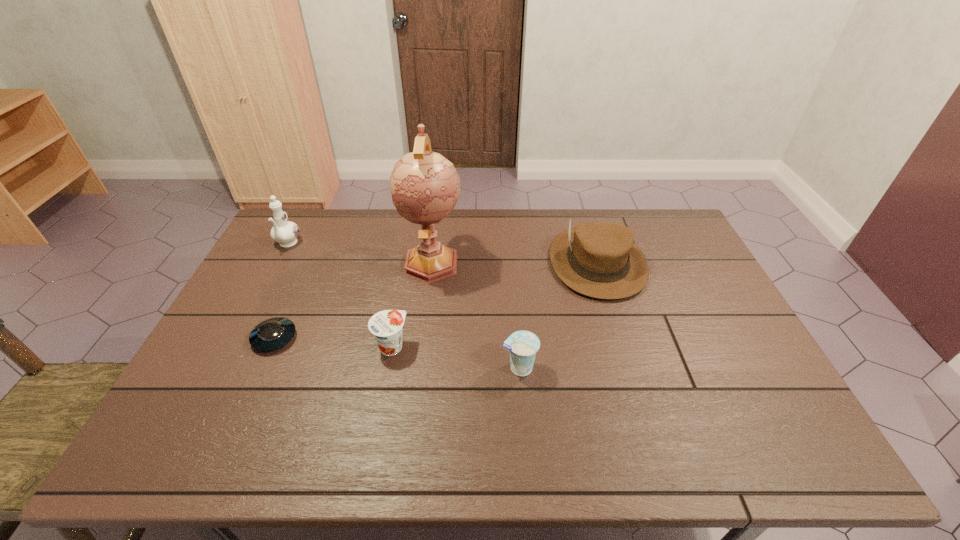
I want to click on the tallest object, so click(x=425, y=186).

You are a GUI agent. You are given a task and a screenshot of the screen. Output one action in this format:
    pyautogui.click(x=<x>, y=<y>)
    Task: Click on the chinaware
    
    Given the screenshot: What is the action you would take?
    pyautogui.click(x=284, y=232)

The height and width of the screenshot is (540, 960). I want to click on the rightmost object, so click(600, 260).

The width and height of the screenshot is (960, 540). I want to click on the right yogurt, so click(x=523, y=345).

Where is `the left yogurt`? The height and width of the screenshot is (540, 960). the left yogurt is located at coordinates (386, 326).

Identify the location of saucer. This screenshot has width=960, height=540. (274, 333).

Locate an element on the screen. The height and width of the screenshot is (540, 960). vacant space located on the front-facing side of the tallest object is located at coordinates (417, 382).

In order to click on vacant region located at the spout of the chinaware in this screenshot , I will do `click(246, 323)`.

Image resolution: width=960 pixels, height=540 pixels. In order to click on vacant space located on the feather side of the fedora in this screenshot , I will do `click(638, 397)`.

Locate an element on the screen. The image size is (960, 540). free space located on the front of the right yogurt is located at coordinates (522, 412).